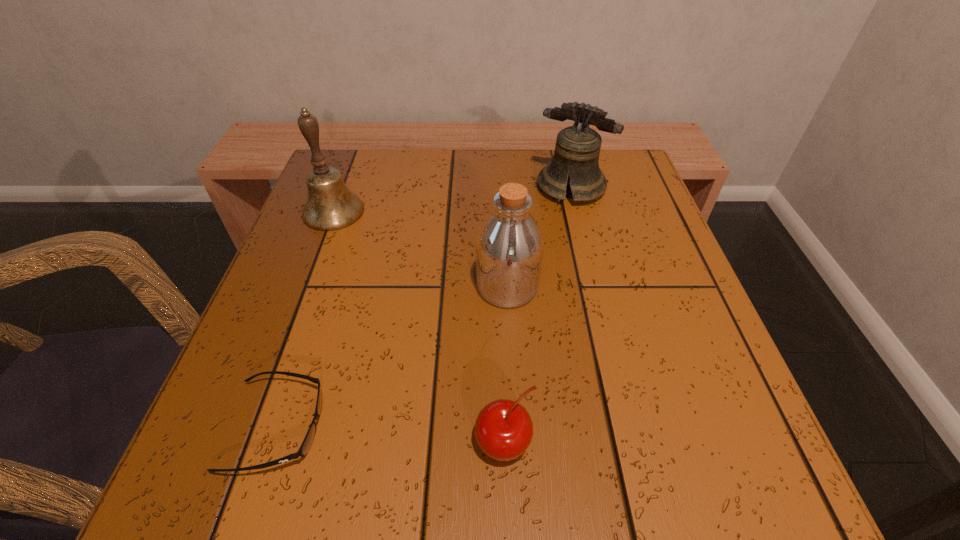
The image size is (960, 540). In the image, there is a desktop. In order to click on vacant space at the near edge in this screenshot , I will do `click(441, 453)`.

This screenshot has width=960, height=540. In order to click on free space at the left edge of the desktop in this screenshot , I will do `click(294, 234)`.

Identify the location of vacant space at the right edge of the desktop. This screenshot has width=960, height=540. (x=649, y=396).

I want to click on free space at the far left corner of the desktop, so click(380, 174).

I want to click on free spot at the near left corner of the desktop, so click(x=195, y=496).

Where is `vacant space at the near right corner`? Image resolution: width=960 pixels, height=540 pixels. vacant space at the near right corner is located at coordinates (758, 449).

I want to click on free point between the second shortest object and the left bell, so (x=419, y=328).

The width and height of the screenshot is (960, 540). What are the coordinates of `unoccupied area between the cherry and the left bell` in the screenshot? It's located at (419, 328).

Find the location of `blank region between the sunglasses and the third farthest object`. blank region between the sunglasses and the third farthest object is located at coordinates (392, 357).

Where is `vacant area that lies between the third nearest object and the sunglasses`? Image resolution: width=960 pixels, height=540 pixels. vacant area that lies between the third nearest object and the sunglasses is located at coordinates 392,357.